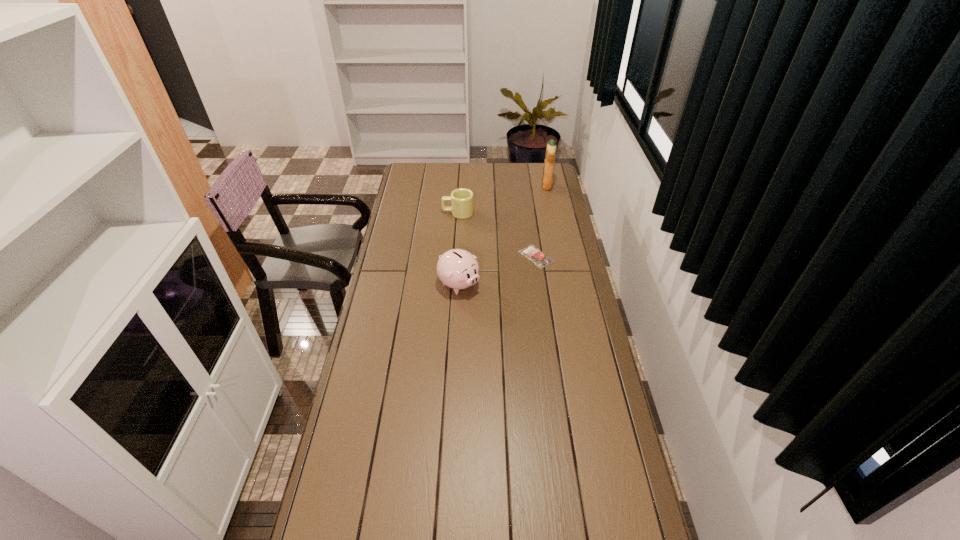
What are the coordinates of `the farthest object` in the screenshot? It's located at (547, 178).

Locate an element on the screen. The height and width of the screenshot is (540, 960). the rightmost object is located at coordinates (547, 178).

This screenshot has height=540, width=960. What are the coordinates of `the nearest object` in the screenshot? It's located at (458, 269).

Locate an element on the screen. piggy bank is located at coordinates (458, 269).

This screenshot has width=960, height=540. In order to click on the second farthest object in this screenshot , I will do (x=462, y=204).

This screenshot has height=540, width=960. I want to click on the second shortest object, so click(x=462, y=204).

The height and width of the screenshot is (540, 960). Find the location of `steak`. steak is located at coordinates (540, 259).

Locate an element on the screen. The height and width of the screenshot is (540, 960). the shortest object is located at coordinates (540, 259).

You are a GUI agent. You are given a task and a screenshot of the screen. Output one action in this format:
    pyautogui.click(x=<x>, y=<y>)
    Task: Click on the vacant space located on the label of the rightmost object
    The width and height of the screenshot is (960, 540).
    Given the screenshot: What is the action you would take?
    pyautogui.click(x=482, y=186)

Find the location of a particular element. The width and height of the screenshot is (960, 540). vacant region located on the label of the rightmost object is located at coordinates (482, 186).